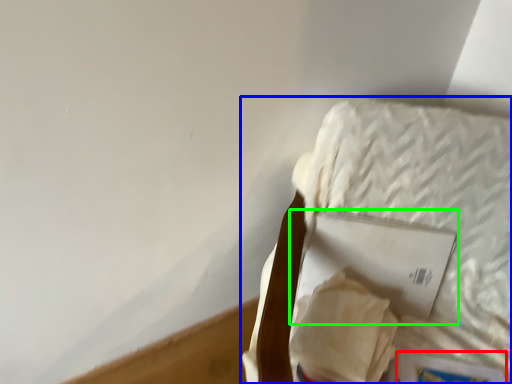
Question: Estimate the real-world distances between objects in this image. Which object is farther from paperback book (highlighted by a red box), furniture (highlighted by a blue box) or paperback book (highlighted by a green box)?

Choices:
 (A) furniture
 (B) paperback book

Answer: (A)